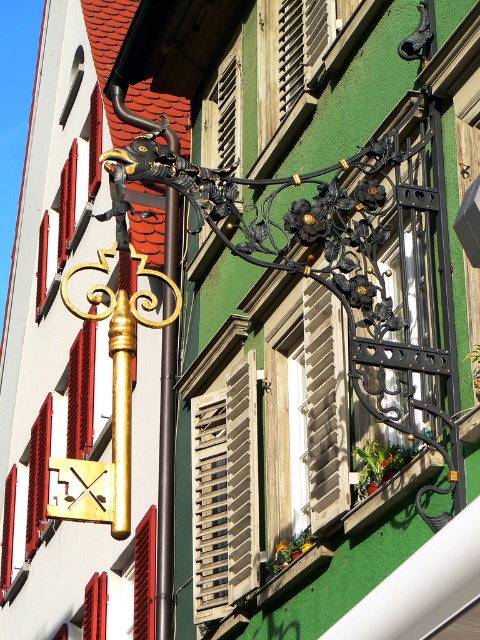
You are standing in front of the building and want to hang a small bird feeder. The feeder requires a hook that must be placed above a window. The red wooden shutter at lower left is part of a window. Is the gold polished metal pole at center left a suitable location for the hook?

The gold polished metal pole at center left is located above the red wooden shutter at lower left, which is part of a window. Therefore, the gold polished metal pole at center left is a suitable location for the hook since it is positioned above the window.

Based on the photo, you are standing in front of the architectural detail and want to touch the point at coordinates (233, 499). Is this point within arm reach?

The point at coordinates (233, 499) is 156.55 feet away from the viewer, which is much farther than an average person can reach with their arm. Therefore, it is not within arm reach.